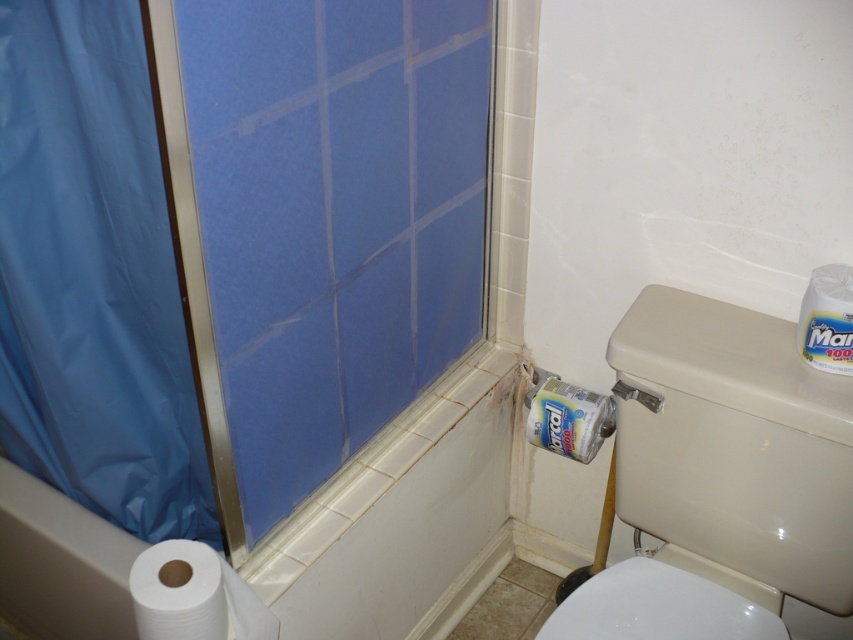
Question: Which point appears closest to the camera in this image?

Choices:
 (A) (813, 496)
 (B) (184, 352)
 (C) (277, 634)

Answer: (C)

Question: Which object is the closest to the matte plastic toilet paper holder at lower right?

Choices:
 (A) white paper at lower left
 (B) white glossy toilet paper at lower right
 (C) blue plastic shower curtain at left
 (D) blue matte shower door at left

Answer: (B)

Question: Is white paper at lower left to the left of white glossy toilet paper at upper right from the viewer's perspective?

Choices:
 (A) yes
 (B) no

Answer: (A)

Question: Is blue plastic shower curtain at left thinner than white glossy toilet paper at lower right?

Choices:
 (A) no
 (B) yes

Answer: (A)

Question: Is white glossy toilet bowl at lower right to the right of white glossy toilet paper at lower right from the viewer's perspective?

Choices:
 (A) yes
 (B) no

Answer: (A)

Question: Estimate the real-world distances between objects in this image. Which object is farther from the white glossy toilet paper at upper right?

Choices:
 (A) blue matte shower door at left
 (B) matte plastic toilet paper holder at lower right
 (C) white glossy toilet bowl at lower right
 (D) white glossy toilet paper at lower right

Answer: (A)